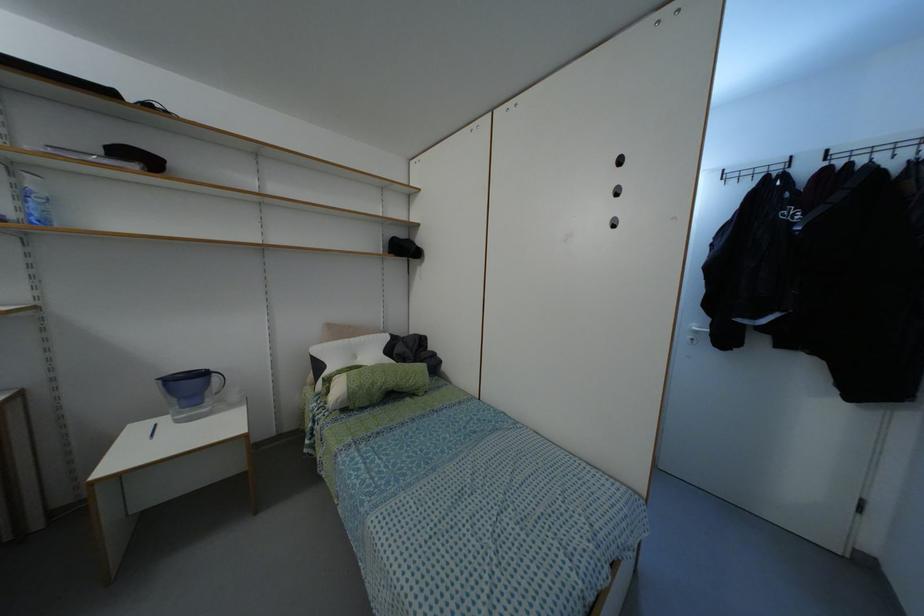
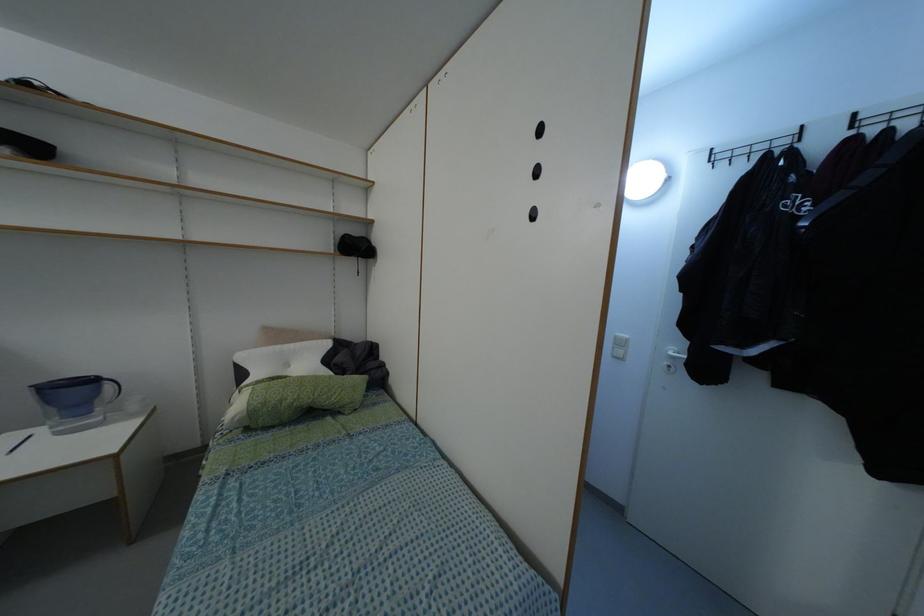
Question: The camera is either moving clockwise (left) or counter-clockwise (right) around the object. The first image is from the beginning of the video and the second image is from the end. Is the camera moving left or right when shooting the video?

Choices:
 (A) Left
 (B) Right

Answer: (B)